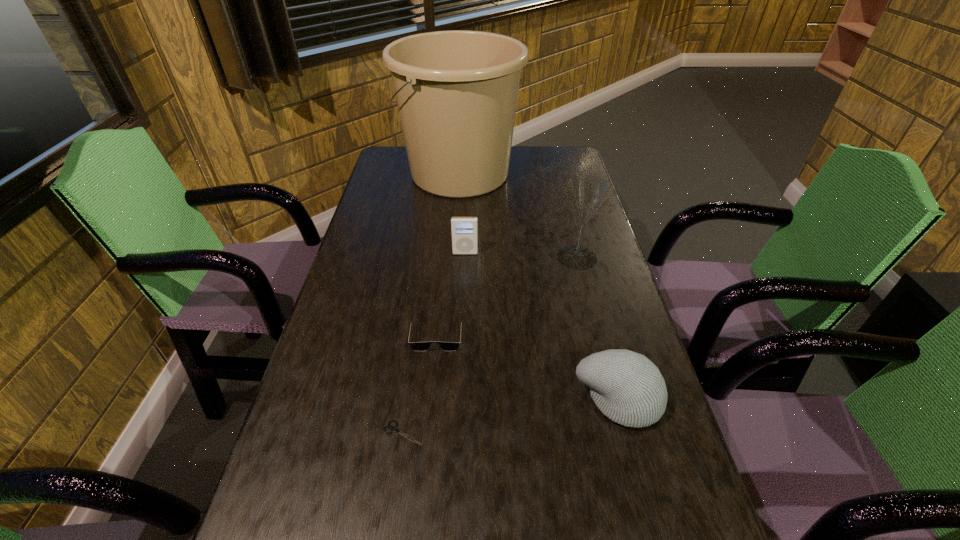
You are a GUI agent. You are given a task and a screenshot of the screen. Output one action in this format:
    pyautogui.click(x=<x>, y=<y>)
    Task: Click on the vacant area situated on the front-facing side of the iPod
    
    Given the screenshot: What is the action you would take?
    pyautogui.click(x=464, y=301)

This screenshot has width=960, height=540. In order to click on vacant space located 0.100m on the left of the beanie in this screenshot , I will do (x=527, y=399).

The image size is (960, 540). What are the coordinates of `free space located on the front-facing side of the sunglasses` in the screenshot? It's located at (425, 451).

Locate an element on the screen. The width and height of the screenshot is (960, 540). vacant position located on the back of the shortest object is located at coordinates (413, 364).

At what (x,y) coordinates should I click in order to perform the action: click on object present at the far edge. Please return your answer as a coordinate pair (x, y). Looking at the image, I should click on click(x=456, y=91).

This screenshot has height=540, width=960. Identify the location of object present at the left edge. pos(456,91).

Where is `flute glass situated at the right edge`? Image resolution: width=960 pixels, height=540 pixels. flute glass situated at the right edge is located at coordinates (588, 195).

The height and width of the screenshot is (540, 960). In order to click on beanie located at the right edge in this screenshot , I will do `click(628, 388)`.

Find the location of `object that is at the far left corner`. object that is at the far left corner is located at coordinates (456, 91).

Where is `vacant space at the far edge of the desktop`? This screenshot has height=540, width=960. vacant space at the far edge of the desktop is located at coordinates (528, 153).